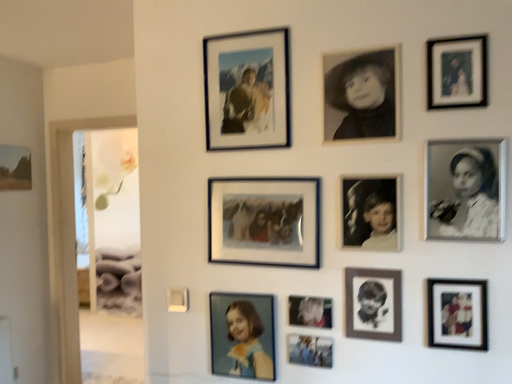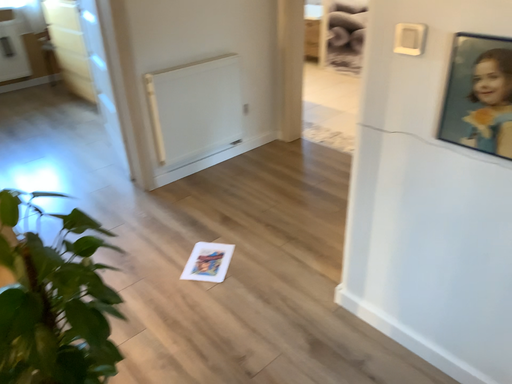
Question: Which way did the camera rotate in the video?

Choices:
 (A) rotated downward
 (B) rotated upward

Answer: (A)